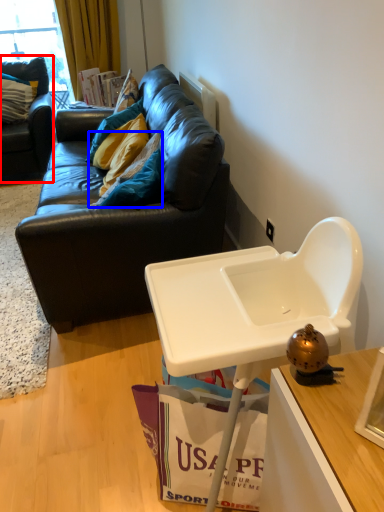
Question: Which of the following is the closest to the observer, studio couch (highlighted by a red box) or pillow (highlighted by a blue box)?

Choices:
 (A) studio couch
 (B) pillow

Answer: (B)